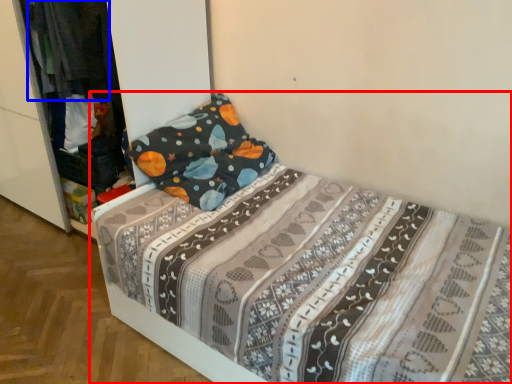
Question: Which object appears farthest to the camera in this image, bed (highlighted by a red box) or clothing (highlighted by a blue box)?

Choices:
 (A) bed
 (B) clothing

Answer: (B)